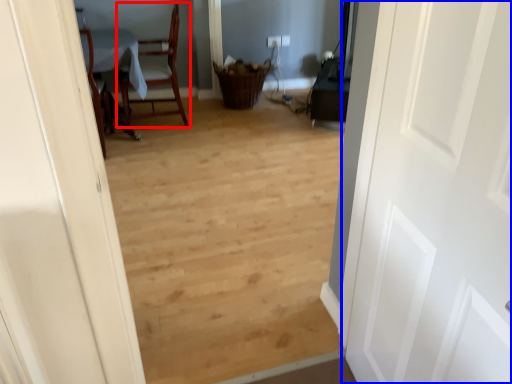
Question: Which of the following is the closest to the observer, chair (highlighted by a red box) or door (highlighted by a blue box)?

Choices:
 (A) chair
 (B) door

Answer: (B)